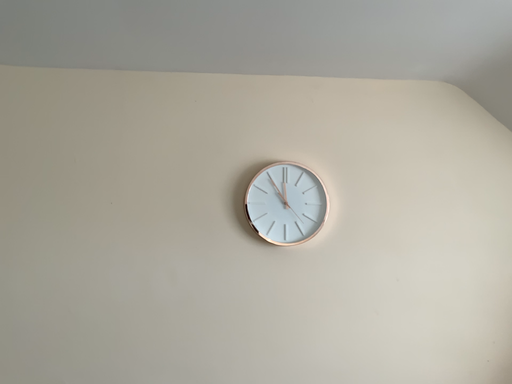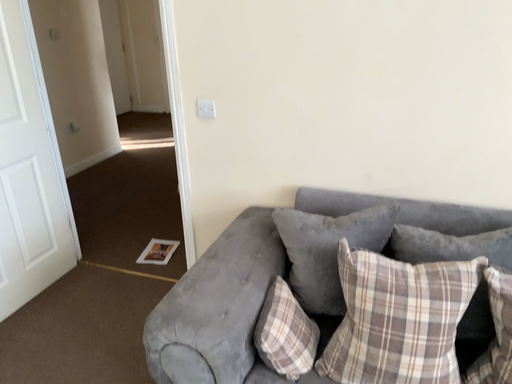
Question: Which way did the camera rotate in the video?

Choices:
 (A) rotated left
 (B) rotated right

Answer: (A)